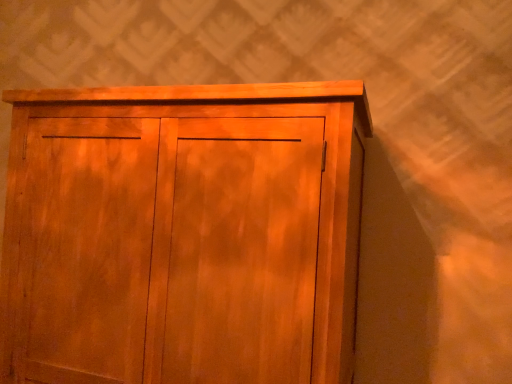
Question: Should I look upward or downward to see wooden cupboard at center?

Choices:
 (A) down
 (B) up

Answer: (A)